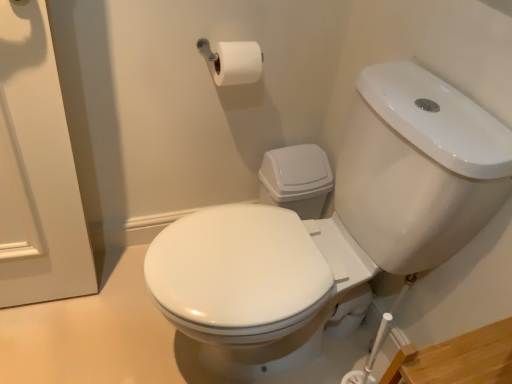
Question: Looking at the image, does white glossy toilet at center seem bigger or smaller compared to white matte toilet paper at upper center?

Choices:
 (A) big
 (B) small

Answer: (A)

Question: From their relative heights in the image, would you say white glossy toilet at center is taller or shorter than white matte toilet paper at upper center?

Choices:
 (A) short
 (B) tall

Answer: (B)

Question: From the image's perspective, relative to white matte toilet paper at upper center, is white glossy toilet at center above or below?

Choices:
 (A) above
 (B) below

Answer: (B)

Question: In the image, is white matte toilet paper at upper center on the left side or the right side of white glossy toilet at center?

Choices:
 (A) right
 (B) left

Answer: (B)

Question: From a real-world perspective, is white matte toilet paper at upper center positioned above or below white glossy toilet at center?

Choices:
 (A) below
 (B) above

Answer: (B)

Question: Considering the positions of white matte toilet paper at upper center and white glossy toilet at center in the image, is white matte toilet paper at upper center taller or shorter than white glossy toilet at center?

Choices:
 (A) tall
 (B) short

Answer: (B)

Question: Is point (253, 54) positioned closer to the camera than point (267, 221)?

Choices:
 (A) closer
 (B) farther

Answer: (B)